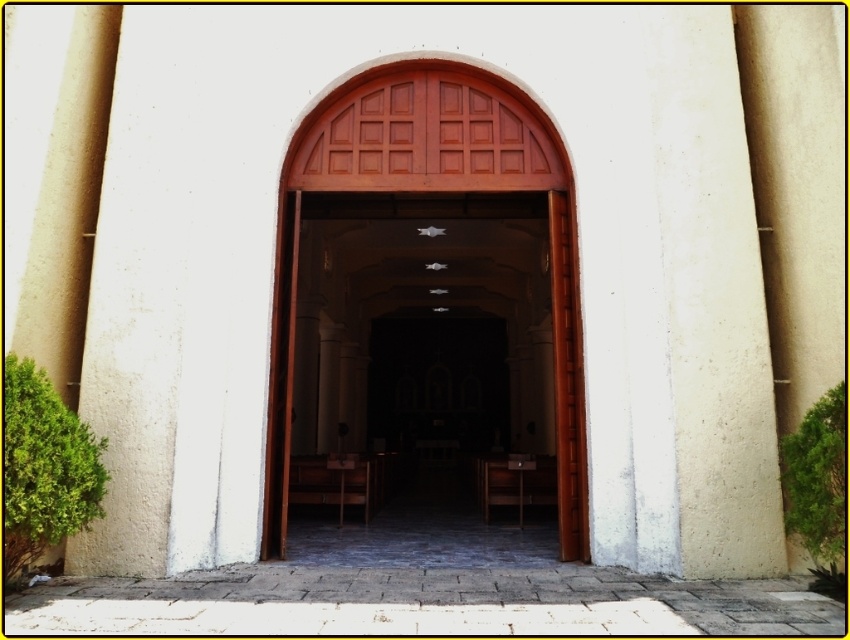
Is smooth beige pillar at left taller than brown wooden chair at center?

Yes.

Is point (20, 305) positioned before point (514, 465)?

Yes.

Find the location of `smooth beige pillar at left`. smooth beige pillar at left is located at coordinates click(x=54, y=177).

Who is positioned more to the right, beige concrete pillar at right or brown wooden chair at center?

Positioned to the right is beige concrete pillar at right.

Which is in front, point (794, 212) or point (523, 467)?

Point (794, 212) is in front.

Locate an element on the screen. Image resolution: width=850 pixels, height=640 pixels. beige concrete pillar at right is located at coordinates (796, 189).

This screenshot has width=850, height=640. What do you see at coordinates (426, 291) in the screenshot? I see `smooth wood door at center` at bounding box center [426, 291].

Who is more distant from viewer, (343, 96) or (661, 173)?

Point (343, 96)

This screenshot has height=640, width=850. Describe the element at coordinates (426, 291) in the screenshot. I see `smooth wood door at center` at that location.

Where is `smooth wood door at center`? smooth wood door at center is located at coordinates (426, 291).